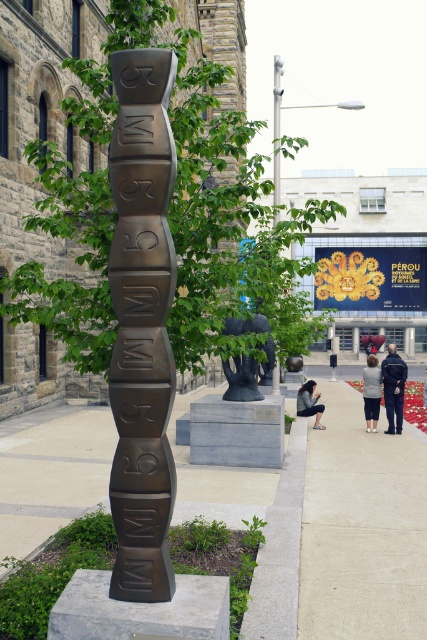
Which is below, black matte sculpture at center or dark gray sweater at center?

dark gray sweater at center is lower down.

Is point (256, 314) closer to viewer compared to point (363, 378)?

Yes, it is.

Locate an element on the screen. The width and height of the screenshot is (427, 640). black matte sculpture at center is located at coordinates (242, 380).

Is point (140, 134) closer to viewer compared to point (266, 346)?

Yes.

Consider the image. Does bronze textured totem pole at center appear on the left side of black matte sculpture at center?

Yes, bronze textured totem pole at center is to the left of black matte sculpture at center.

Measure the distance between bronze textured totem pole at center and camera.

A distance of 3.65 meters exists between bronze textured totem pole at center and camera.

I want to click on bronze textured totem pole at center, so click(x=142, y=323).

Between dark blue uniform at center and dark gray sweater at center, which one is positioned lower?

dark gray sweater at center is below.

Is dark blue uniform at center further to the viewer compared to dark gray sweater at center?

No, it is in front of dark gray sweater at center.

Describe the element at coordinates (394, 387) in the screenshot. This screenshot has width=427, height=640. I see `dark blue uniform at center` at that location.

Locate an element on the screen. dark blue uniform at center is located at coordinates (394, 387).